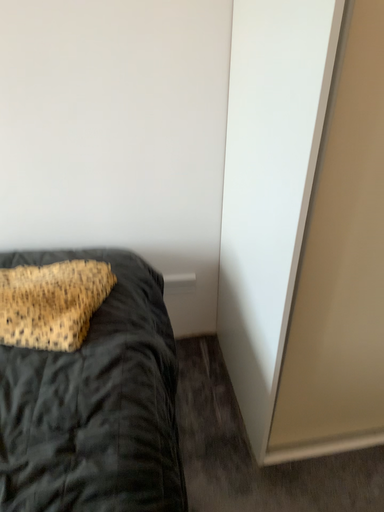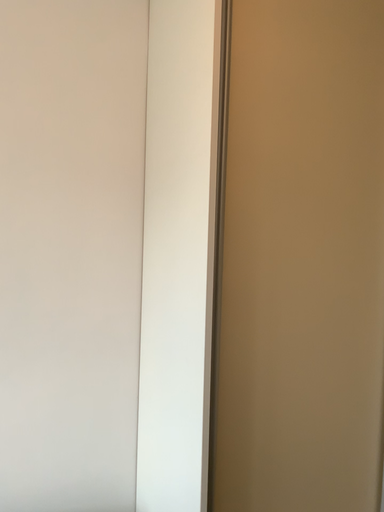
Question: Which way did the camera rotate in the video?

Choices:
 (A) rotated right
 (B) rotated left

Answer: (A)